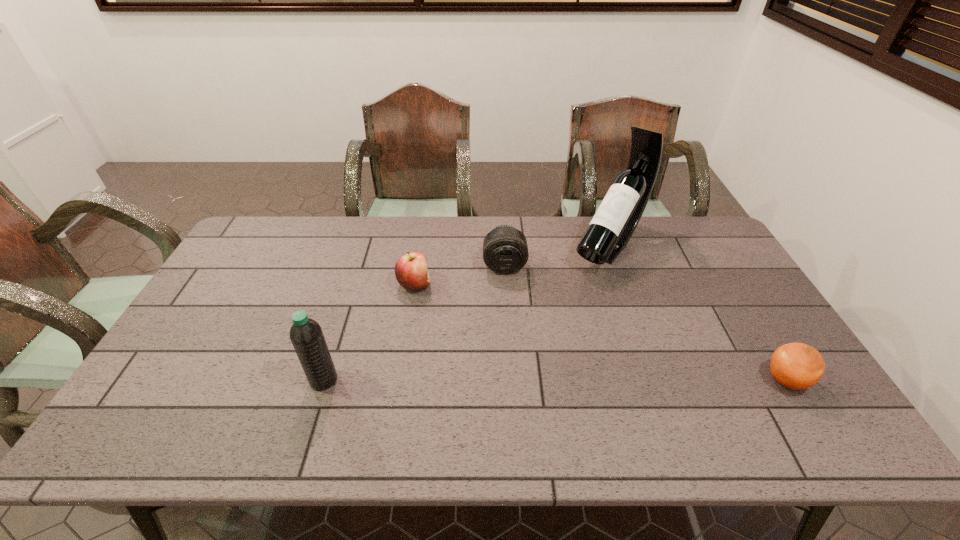
Where is `water bottle`? The image size is (960, 540). water bottle is located at coordinates (306, 335).

Locate an element on the screen. the second tallest object is located at coordinates (306, 335).

The image size is (960, 540). I want to click on the rightmost object, so click(798, 366).

Locate an element on the screen. the third shortest object is located at coordinates (505, 251).

I want to click on the third object from left to right, so click(505, 251).

You are a GUI agent. You are given a task and a screenshot of the screen. Output one action in this format:
    pyautogui.click(x=<x>, y=<y>)
    Task: Click on the second object from left to right
    The width and height of the screenshot is (960, 540).
    Given the screenshot: What is the action you would take?
    pyautogui.click(x=411, y=270)

Image resolution: width=960 pixels, height=540 pixels. Find the location of `wine bottle`. wine bottle is located at coordinates (617, 217).

Where is `the tallest object`? The image size is (960, 540). the tallest object is located at coordinates (617, 217).

In order to click on vacant space located on the left of the fourth shortest object in this screenshot , I will do `click(234, 380)`.

Find the location of a particular element. vacant point located on the back of the orange is located at coordinates (733, 295).